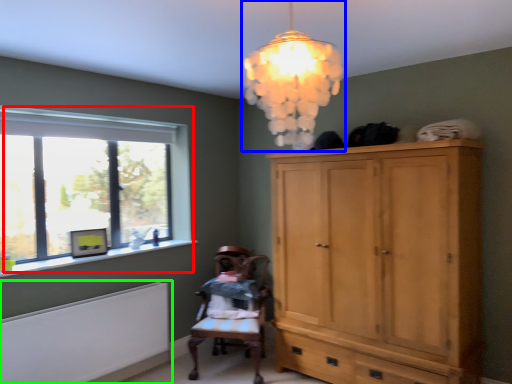
Question: Which object is positioned farthest from window (highlighted by a red box)? Select from lamp (highlighted by a blue box) and radiator (highlighted by a green box).

Choices:
 (A) lamp
 (B) radiator

Answer: (A)